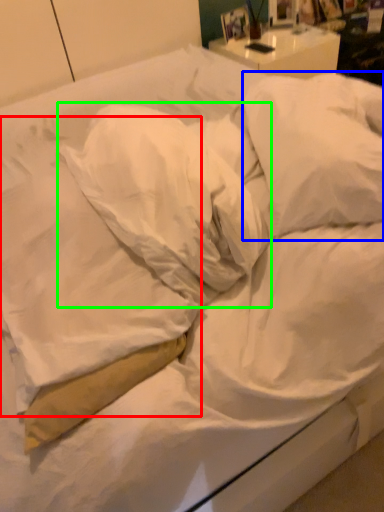
Question: Which object is positioned farthest from pillow (highlighted by a red box)? Select from pillow (highlighted by a blue box) and pillow (highlighted by a green box).

Choices:
 (A) pillow
 (B) pillow

Answer: (A)